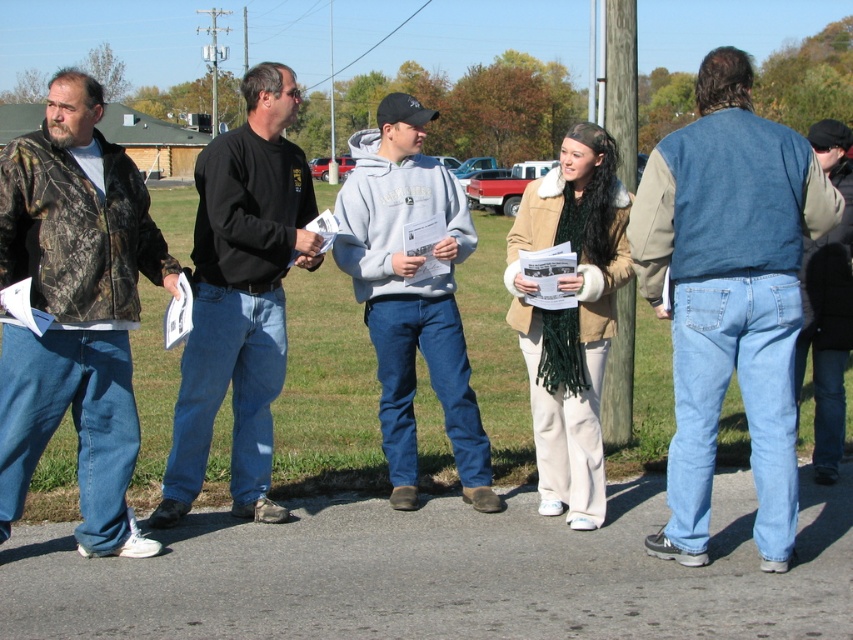
You are standing at the point labeled point (791, 189) and want to reach the point labeled point (115, 496). Which direction should you move to get closer to your destination?

You should move downward and to the right because point (115, 496) is located to the lower right of point (791, 189).

You are a photographer trying to capture a group photo of the camo jacket at left and the gray fleece sweatshirt at center. To ensure both are in focus, you need to know which one is taller. Can you tell me which is taller?

The camo jacket at left is much taller than the gray fleece sweatshirt at center, so the photographer should focus on the camo jacket at left to ensure both are in focus.

You are standing at the origin point of the coordinate system where the bottom left corner is 0,0 and the top right corner is 1,1. You need to locate the gray fleece sweatshirt at center. What are its coordinates?

The gray fleece sweatshirt at center is located at coordinates (410, 292).